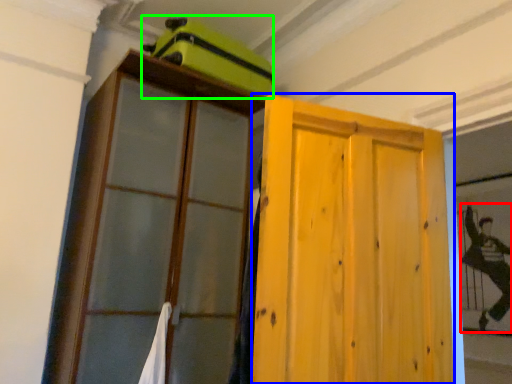
Question: Based on their relative distances, which object is farther from couple (highlighted by a red box)? Choose from door (highlighted by a blue box) and luggage (highlighted by a green box).

Choices:
 (A) door
 (B) luggage

Answer: (B)